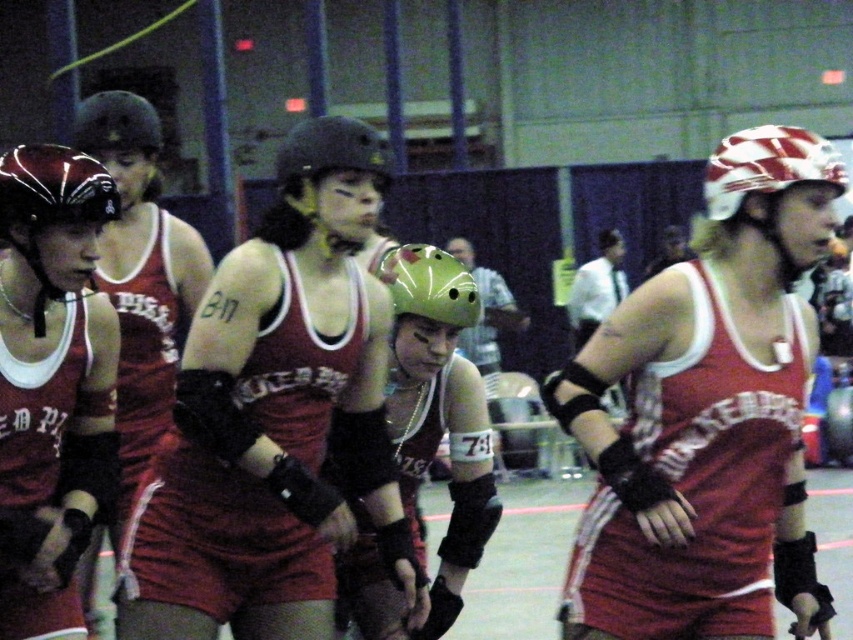
You are a referee in the roller derby game. You need to determine which helmet is narrower between the matte red helmet at left and the matte black helmet at center. Which one should you choose?

The matte red helmet at left has a lesser width compared to the matte black helmet at center, so you should choose the matte red helmet at left as the narrower one.

You are a referee in the roller derby game and need to determine the position of the helmets. Which helmet is positioned to the right when looking at the matte green helmet at center and the matte black helmet at center?

The matte green helmet at center is to the right of the matte black helmet at center.

You are a referee in the roller derby game. You notice two helmets at the center of the arena. Which helmet is taller, the matte red helmet at center or the green matte helmet at center?

The matte red helmet at center is taller than the green matte helmet at center according to the description.